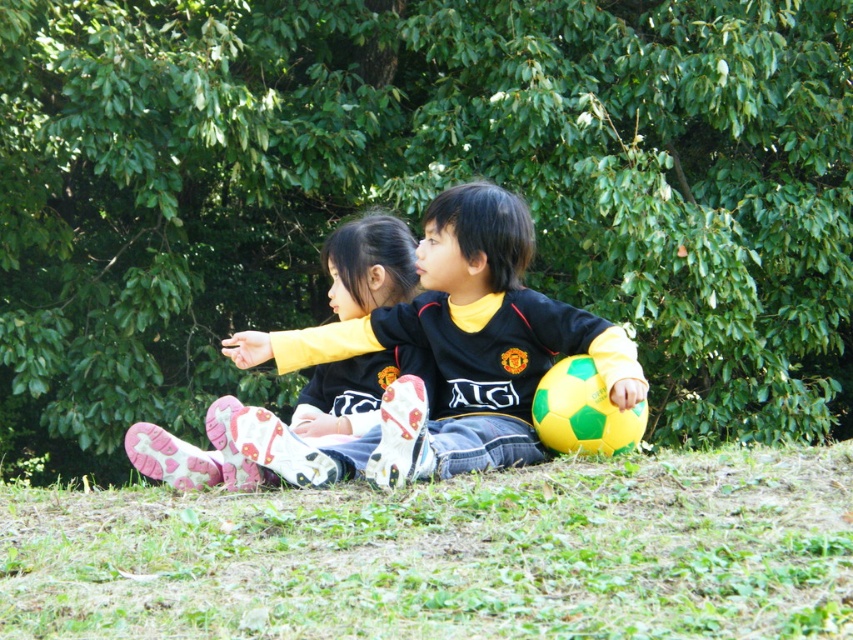
Question: Can you confirm if green grass at lower center is smaller than pink fabric socks at lower left?

Choices:
 (A) no
 (B) yes

Answer: (A)

Question: Does black jersey at center appear on the right side of pink fabric socks at lower left?

Choices:
 (A) no
 (B) yes

Answer: (B)

Question: Does green grass at lower center have a larger size compared to pink fabric socks at lower left?

Choices:
 (A) no
 (B) yes

Answer: (B)

Question: Among these points, which one is farthest from the camera?

Choices:
 (A) (730, 470)
 (B) (264, 477)
 (C) (3, 397)
 (D) (488, 272)

Answer: (C)

Question: Which point is closer to the camera?

Choices:
 (A) (368, 417)
 (B) (585, 141)
 (C) (558, 488)

Answer: (C)

Question: Estimate the real-world distances between objects in this image. Which object is closer to the green grass at lower center?

Choices:
 (A) green leafy tree at center
 (B) pink fabric socks at lower left
 (C) black jersey at center

Answer: (C)